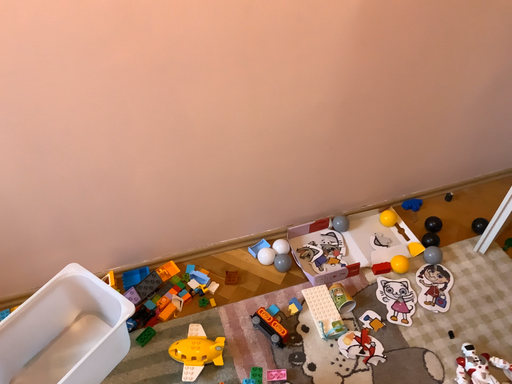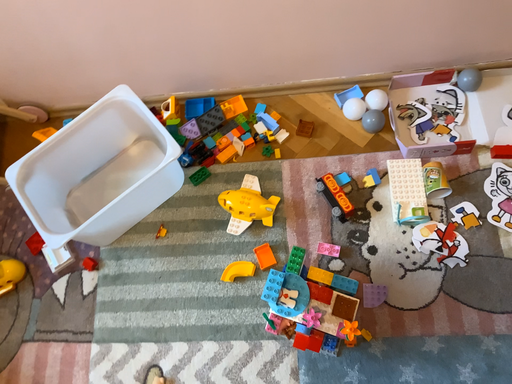
Question: Which way did the camera rotate in the video?

Choices:
 (A) rotated left
 (B) rotated right

Answer: (A)